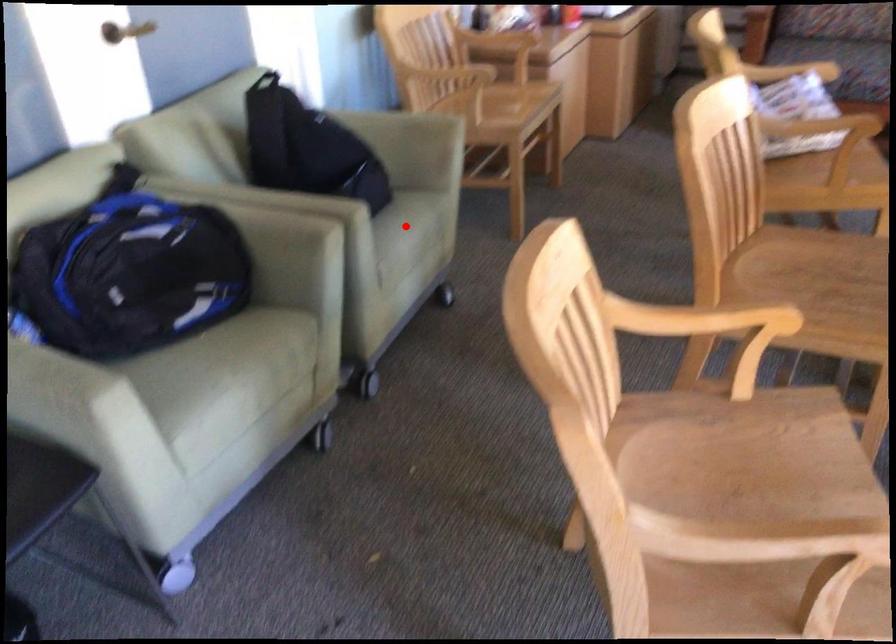
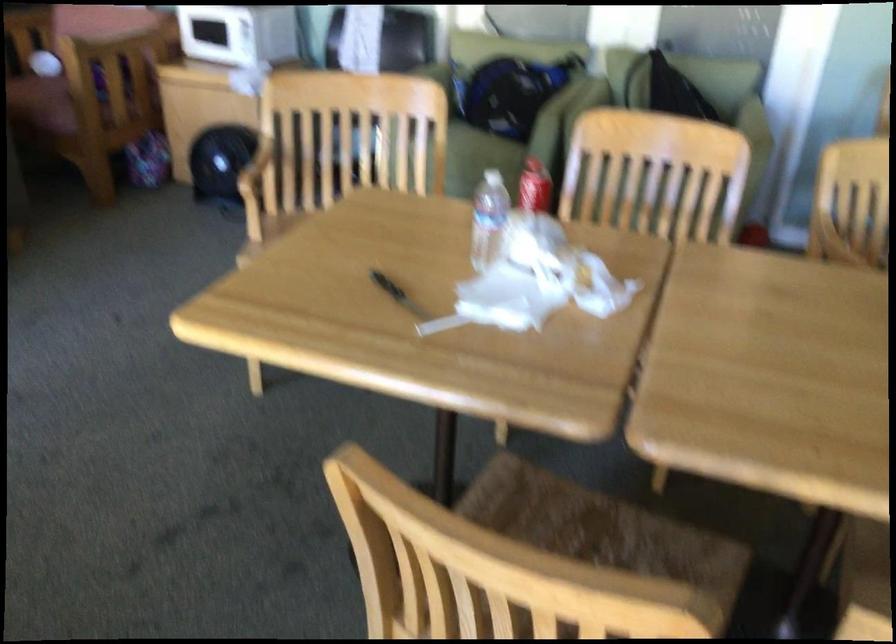
Question: I am providing you with two images of the same scene from different viewpoints. A red point is marked on the first image. At the location where the point appears in image 1, is it still visible in image 2?

Choices:
 (A) Yes
 (B) No

Answer: (B)